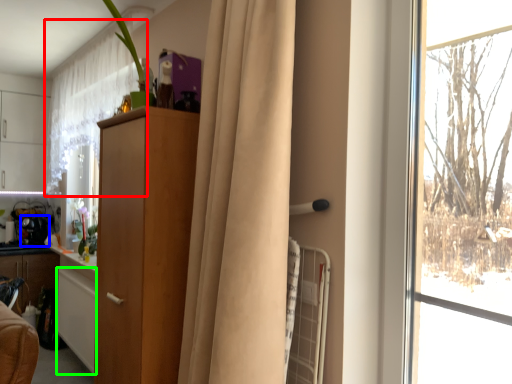
Question: Which object is positioned closest to curtain (highlighted by a red box)? Select from appliance (highlighted by a blue box) and cabinetry (highlighted by a green box).

Choices:
 (A) appliance
 (B) cabinetry

Answer: (B)